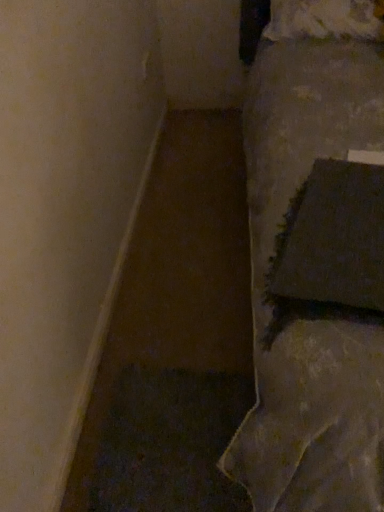
Question: Considering the positions of dark fabric pillow at right, the second pillow in the back-to-front sequence, and white fluffy pillow at upper right, which ranks as the 1th pillow in back-to-front order, in the image, is dark fabric pillow at right, the second pillow in the back-to-front sequence, bigger or smaller than white fluffy pillow at upper right, which ranks as the 1th pillow in back-to-front order,?

Choices:
 (A) big
 (B) small

Answer: (B)

Question: Looking at their shapes, would you say dark fabric pillow at right, the first pillow in the front-to-back sequence, is wider or thinner than white fluffy pillow at upper right, marked as the second pillow in a bottom-to-top arrangement?

Choices:
 (A) thin
 (B) wide

Answer: (B)

Question: In terms of height, does dark fabric pillow at right, the second pillow in the back-to-front sequence, look taller or shorter compared to white fluffy pillow at upper right, the 1th pillow positioned from the top?

Choices:
 (A) tall
 (B) short

Answer: (B)

Question: From a real-world perspective, is white fluffy pillow at upper right, marked as the second pillow in a bottom-to-top arrangement, physically located above or below dark fabric pillow at right, the 2th pillow when ordered from top to bottom?

Choices:
 (A) above
 (B) below

Answer: (A)

Question: Would you say white fluffy pillow at upper right, marked as the second pillow in a bottom-to-top arrangement, is to the left or to the right of dark fabric pillow at right, the 2th pillow when ordered from top to bottom, in the picture?

Choices:
 (A) left
 (B) right

Answer: (B)

Question: Is white fluffy pillow at upper right, which ranks as the 1th pillow in back-to-front order, inside the boundaries of dark fabric pillow at right, the 2th pillow when ordered from top to bottom, or outside?

Choices:
 (A) inside
 (B) outside

Answer: (B)

Question: In terms of size, does white fluffy pillow at upper right, marked as the second pillow in a bottom-to-top arrangement, appear bigger or smaller than dark fabric pillow at right, the 2th pillow when ordered from top to bottom?

Choices:
 (A) big
 (B) small

Answer: (A)